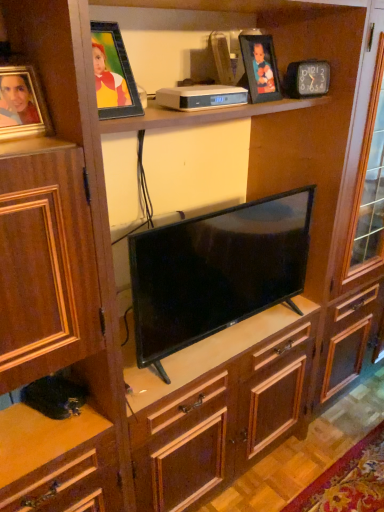
Question: From the image's perspective, is matte gold picture frame at left, positioned as the second picture frame in back-to-front order, above black glossy tv at center?

Choices:
 (A) yes
 (B) no

Answer: (A)

Question: From a real-world perspective, is matte gold picture frame at left, which is counted as the second picture frame, starting from the right, below black glossy tv at center?

Choices:
 (A) no
 (B) yes

Answer: (A)

Question: Is matte gold picture frame at left, which is counted as the second picture frame, starting from the right, facing towards black glossy tv at center?

Choices:
 (A) no
 (B) yes

Answer: (A)

Question: From the image's perspective, is matte gold picture frame at left, which is counted as the second picture frame, starting from the right, located beneath black glossy tv at center?

Choices:
 (A) no
 (B) yes

Answer: (A)

Question: Is matte gold picture frame at left, the first picture frame from the bottom, positioned beyond the bounds of black glossy tv at center?

Choices:
 (A) yes
 (B) no

Answer: (A)

Question: Is matte gold picture frame at left, which is counted as the second picture frame, starting from the right, thinner than black glossy tv at center?

Choices:
 (A) no
 (B) yes

Answer: (B)

Question: From a real-world perspective, is black glossy tv at center under matte black picture frame at upper center, positioned as the second picture frame in left-to-right order?

Choices:
 (A) no
 (B) yes

Answer: (B)

Question: Is black glossy tv at center thinner than matte black picture frame at upper center, positioned as the second picture frame in left-to-right order?

Choices:
 (A) no
 (B) yes

Answer: (A)

Question: Can you see black glossy tv at center touching matte black picture frame at upper center, which ranks as the first picture frame in back-to-front order?

Choices:
 (A) no
 (B) yes

Answer: (A)

Question: Is black glossy tv at center aimed at matte black picture frame at upper center, arranged as the first picture frame when viewed from the top?

Choices:
 (A) yes
 (B) no

Answer: (B)

Question: Is black glossy tv at center oriented away from matte black picture frame at upper center, marked as the 2th picture frame in a bottom-to-top arrangement?

Choices:
 (A) yes
 (B) no

Answer: (B)

Question: Is black glossy tv at center at the left side of matte black picture frame at upper center, which is the first picture frame in right-to-left order?

Choices:
 (A) yes
 (B) no

Answer: (A)

Question: Is black glossy tv at center closer to camera compared to matte gold picture frame at left, acting as the 2th picture frame starting from the top?

Choices:
 (A) no
 (B) yes

Answer: (A)